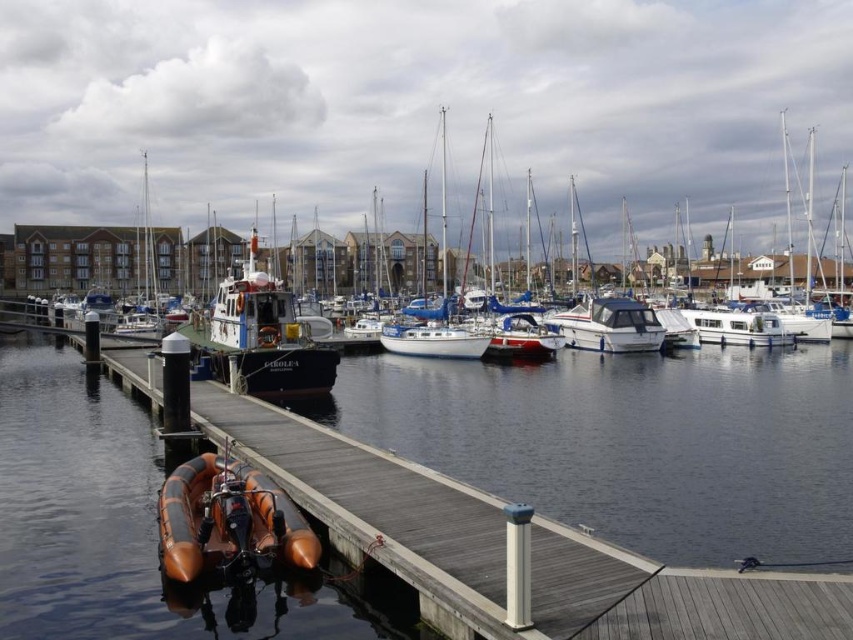
Who is lower down, wooden dock at center or white glossy motorboat at center?

wooden dock at center is lower down.

Is wooden dock at center positioned before white glossy motorboat at center?

Yes, wooden dock at center is in front of white glossy motorboat at center.

Where is `wooden dock at center`? The height and width of the screenshot is (640, 853). wooden dock at center is located at coordinates (631, 445).

Identify the location of wooden dock at center. The height and width of the screenshot is (640, 853). (631, 445).

Which of these two, wooden dock at center or rubber boat at dock, stands shorter?

Standing shorter between the two is rubber boat at dock.

Looking at this image, which is more to the left, wooden dock at center or rubber boat at dock?

Positioned to the left is rubber boat at dock.

Between point (693, 564) and point (103, 573), which one is positioned in front?

Point (103, 573) is more forward.

Identify the location of wooden dock at center. (631, 445).

Does wooden dock at center have a greater width compared to orange rubber dinghy at lower left?

Yes, wooden dock at center is wider than orange rubber dinghy at lower left.

Between wooden dock at center and orange rubber dinghy at lower left, which one appears on the right side from the viewer's perspective?

wooden dock at center is more to the right.

Which is in front, point (836, 396) or point (280, 536)?

Positioned in front is point (280, 536).

At what (x,y) coordinates should I click in order to perform the action: click on wooden dock at center. Please return your answer as a coordinate pair (x, y). Looking at the image, I should click on (631, 445).